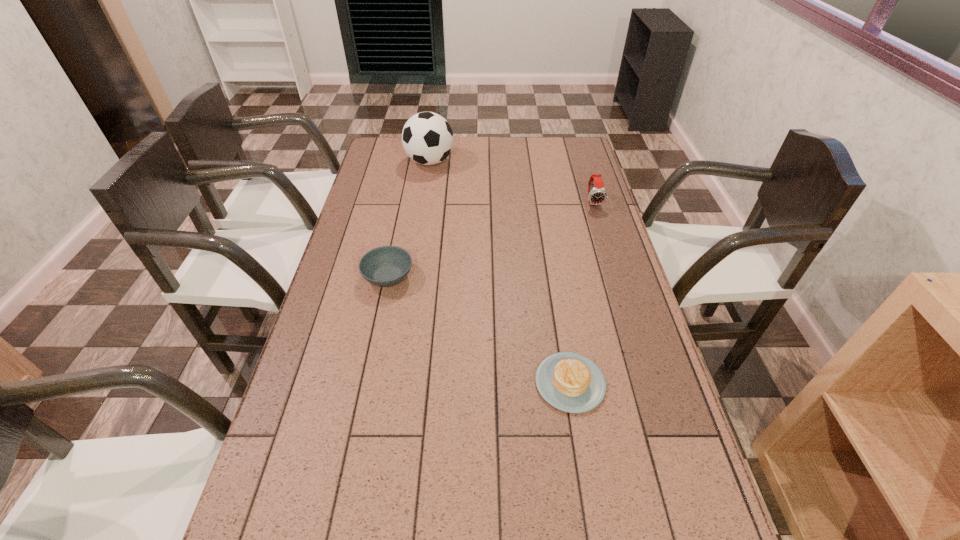
At what (x,y) coordinates should I click in order to perform the action: click on soccer ball. Please return your answer as a coordinate pair (x, y). The image size is (960, 540). Looking at the image, I should click on (427, 138).

Find the location of a particular element. This screenshot has height=540, width=960. the tallest object is located at coordinates (427, 138).

You are a GUI agent. You are given a task and a screenshot of the screen. Output one action in this format:
    pyautogui.click(x=<x>, y=<y>)
    Task: Click on the rightmost object
    The height and width of the screenshot is (540, 960).
    Given the screenshot: What is the action you would take?
    pyautogui.click(x=597, y=195)

In order to click on the second tallest object in this screenshot , I will do `click(597, 195)`.

This screenshot has height=540, width=960. Identify the location of the third farthest object. (385, 266).

Locate an element on the screen. The width and height of the screenshot is (960, 540). the third tallest object is located at coordinates (385, 266).

You are a GUI agent. You are given a task and a screenshot of the screen. Output one action in this format:
    pyautogui.click(x=<x>, y=<y>)
    Task: Click on the nearest object
    
    Given the screenshot: What is the action you would take?
    pyautogui.click(x=570, y=382)

The height and width of the screenshot is (540, 960). I want to click on pancake, so click(x=570, y=382).

Identify the location of vacant area located 0.370m on the right of the farthest object. This screenshot has height=540, width=960. (544, 162).

In order to click on blank space located on the face of the third nearest object in this screenshot , I will do `click(616, 275)`.